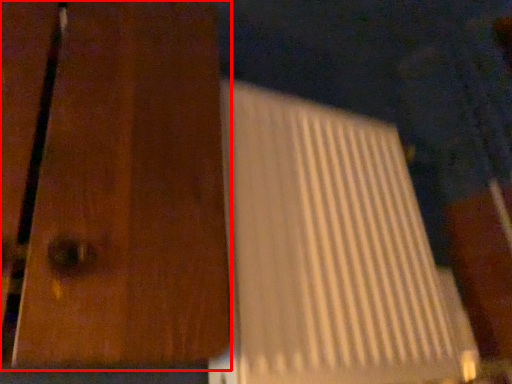
Question: From the image, what is the correct spatial relationship of door (annotated by the red box) in relation to wide?

Choices:
 (A) left
 (B) right

Answer: (A)